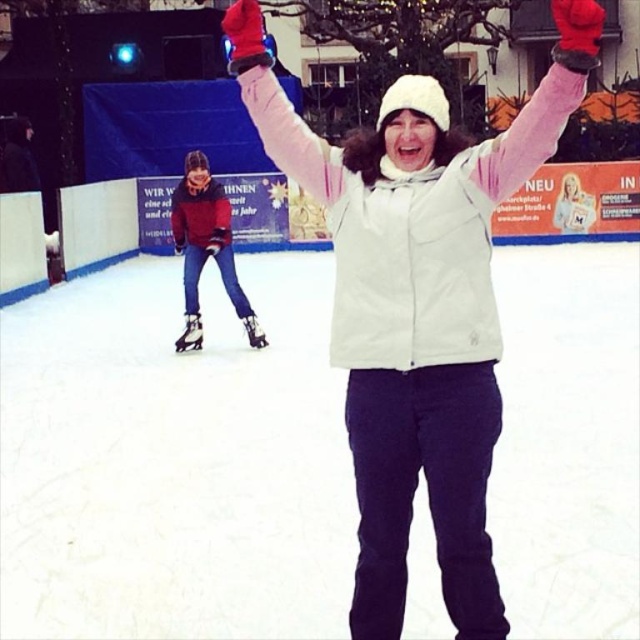
Question: Which of the following is the farthest from the observer?

Choices:
 (A) (576, 528)
 (B) (460, 396)

Answer: (A)

Question: Estimate the real-world distances between objects in this image. Which object is closer to the white matte jacket at center?

Choices:
 (A) matte red jacket at lower left
 (B) white smooth ice at center

Answer: (B)

Question: Does white matte jacket at center appear under matte red jacket at lower left?

Choices:
 (A) yes
 (B) no

Answer: (A)

Question: Observing the image, what is the correct spatial positioning of white smooth ice at center in reference to white matte jacket at center?

Choices:
 (A) below
 (B) above

Answer: (A)

Question: Which object is the closest to the white smooth ice at center?

Choices:
 (A) matte red jacket at lower left
 (B) white matte jacket at center

Answer: (A)

Question: Can you confirm if white matte jacket at center is positioned to the left of matte red jacket at lower left?

Choices:
 (A) no
 (B) yes

Answer: (A)